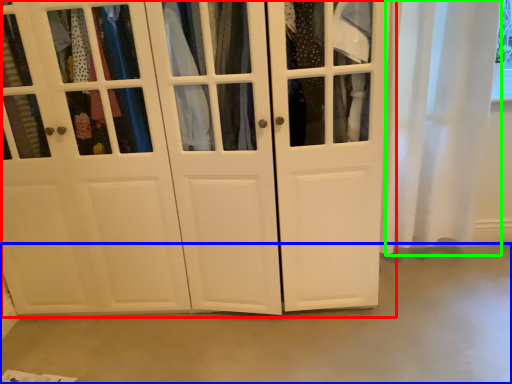
Question: Which is farther away from cupboard (highlighted by a red box)? concrete (highlighted by a blue box) or curtain (highlighted by a green box)?

Choices:
 (A) concrete
 (B) curtain

Answer: (B)